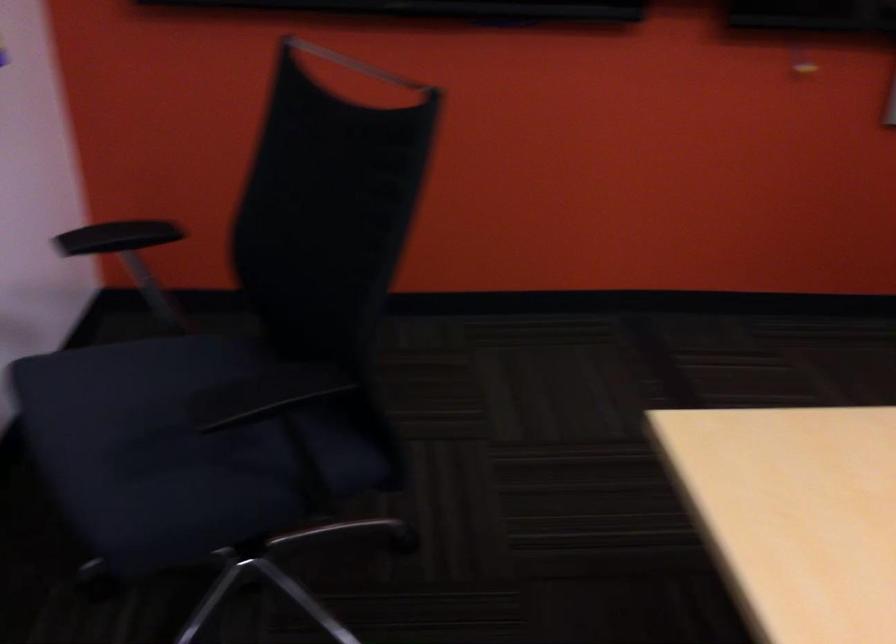
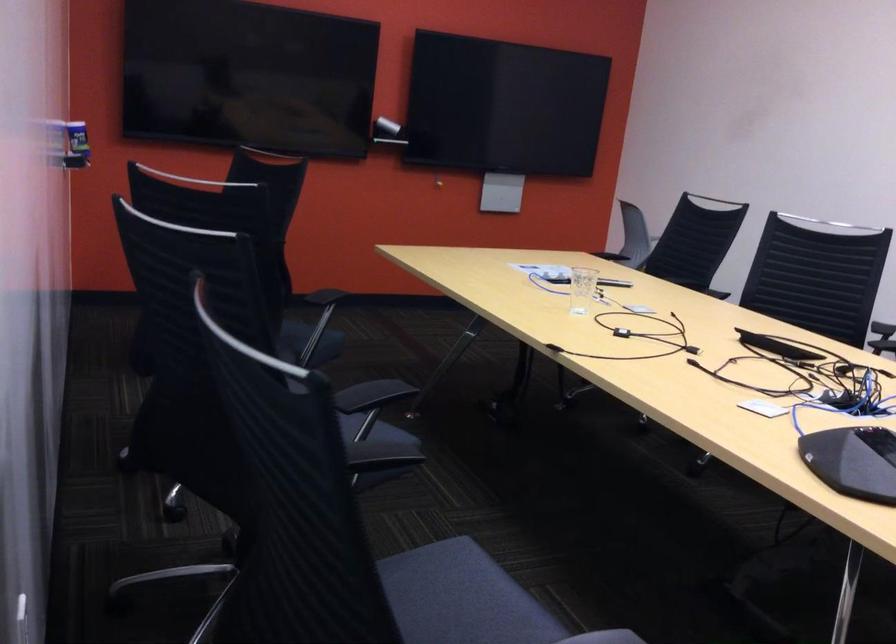
Question: I am providing you with two images of the same scene from different viewpoints. Which of the following objects are not visible in image2?

Choices:
 (A) chair sitting surface
 (B) black chair sitting surface
 (C) clear drinking glass
 (D) drive eject button

Answer: (A)